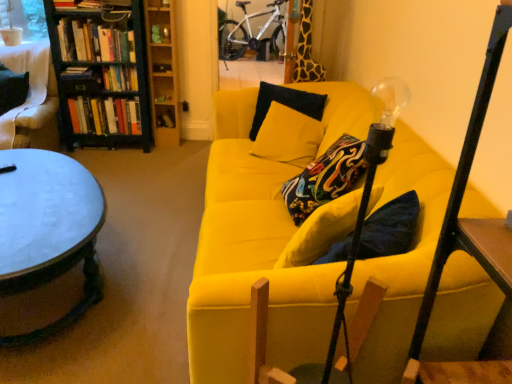
The width and height of the screenshot is (512, 384). I want to click on blank space above metallic round table at left (from a real-world perspective), so click(x=40, y=194).